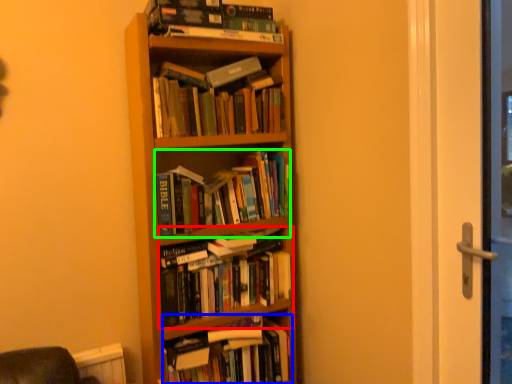
Question: Which object is the closest to the book (highlighted by a red box)? Choose among these: book (highlighted by a blue box) or book (highlighted by a green box).

Choices:
 (A) book
 (B) book

Answer: (A)